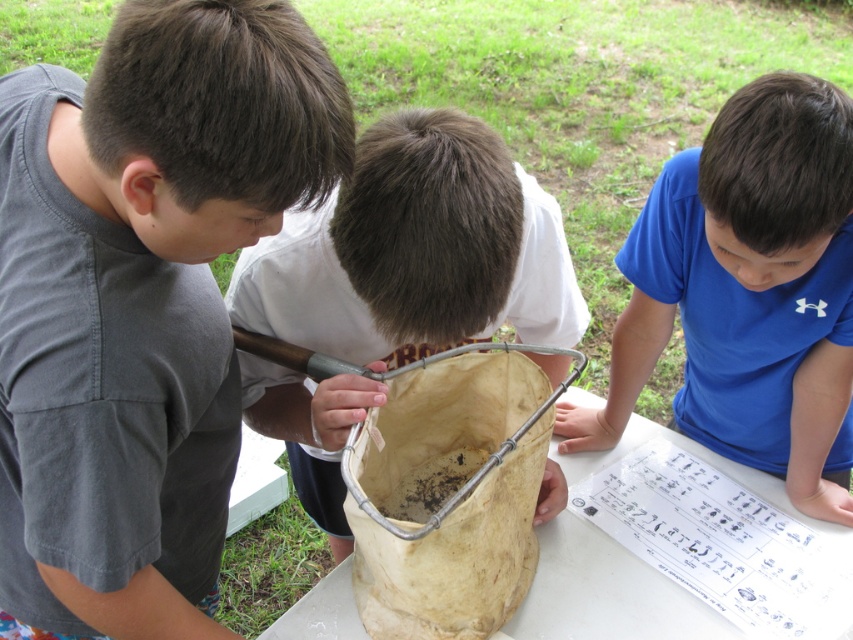
Does gray matte shirt at left have a greater height compared to light brown paper bag at center?

No, gray matte shirt at left is not taller than light brown paper bag at center.

Describe the element at coordinates (141, 300) in the screenshot. The image size is (853, 640). I see `gray matte shirt at left` at that location.

Identify the location of gray matte shirt at left. (141, 300).

Does gray matte shirt at left have a lesser height compared to blue cotton shirt at upper right?

No, gray matte shirt at left is not shorter than blue cotton shirt at upper right.

Does gray matte shirt at left have a smaller size compared to blue cotton shirt at upper right?

Incorrect, gray matte shirt at left is not smaller in size than blue cotton shirt at upper right.

Which is in front, point (91, 428) or point (787, 157)?

Point (91, 428) is in front.

The image size is (853, 640). I want to click on gray matte shirt at left, so click(141, 300).

Can you confirm if blue cotton shirt at upper right is wider than light brown paper bag at center?

Correct, the width of blue cotton shirt at upper right exceeds that of light brown paper bag at center.

Does point (763, 280) lie in front of point (320, 403)?

No, (763, 280) is further to viewer.

Find the location of a particular element. blue cotton shirt at upper right is located at coordinates (747, 292).